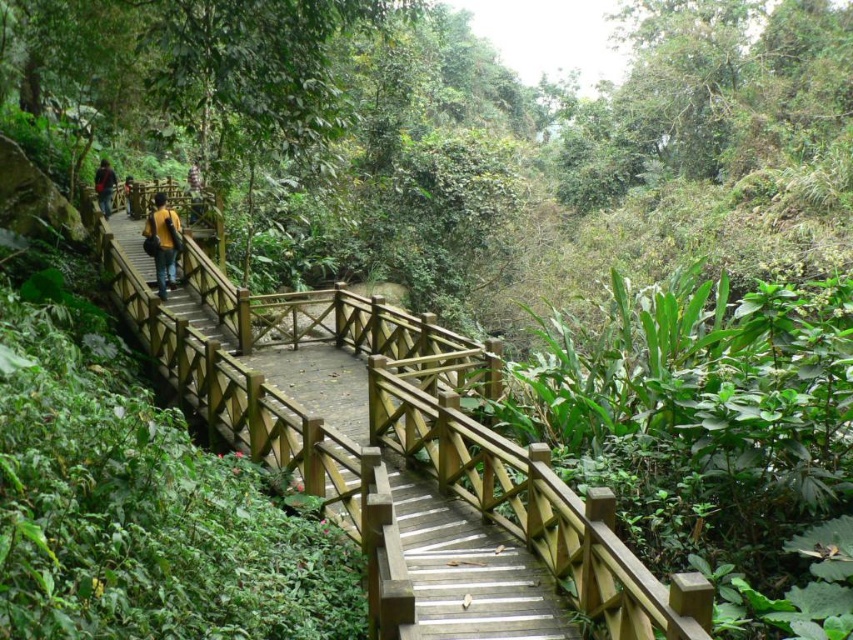
Question: Does yellow matte jacket at center have a smaller size compared to dark blue jeans at center?

Choices:
 (A) yes
 (B) no

Answer: (B)

Question: Does wooden bridge at center have a smaller size compared to yellow matte jacket at center?

Choices:
 (A) yes
 (B) no

Answer: (B)

Question: Which object appears farthest from the camera in this image?

Choices:
 (A) dark brown leather jacket at upper left
 (B) wooden bridge at center
 (C) yellow matte jacket at center

Answer: (A)

Question: Which object is positioned farthest from the matte black backpack at left?

Choices:
 (A) dark blue jeans at center
 (B) wooden bridge at center

Answer: (B)

Question: Among these points, which one is nearest to the camera?

Choices:
 (A) (440, 458)
 (B) (149, 230)
 (C) (194, 208)

Answer: (A)

Question: Is wooden bridge at center further to the viewer compared to yellow matte jacket at center?

Choices:
 (A) no
 (B) yes

Answer: (A)